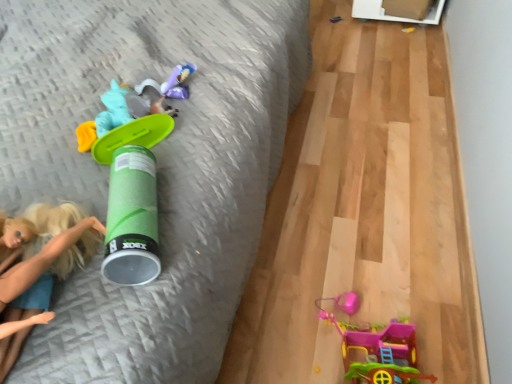
Identify the location of free spot to the right of plastic pink toy house at lower right, the 2th toy in the front-to-back sequence. pyautogui.click(x=450, y=321).